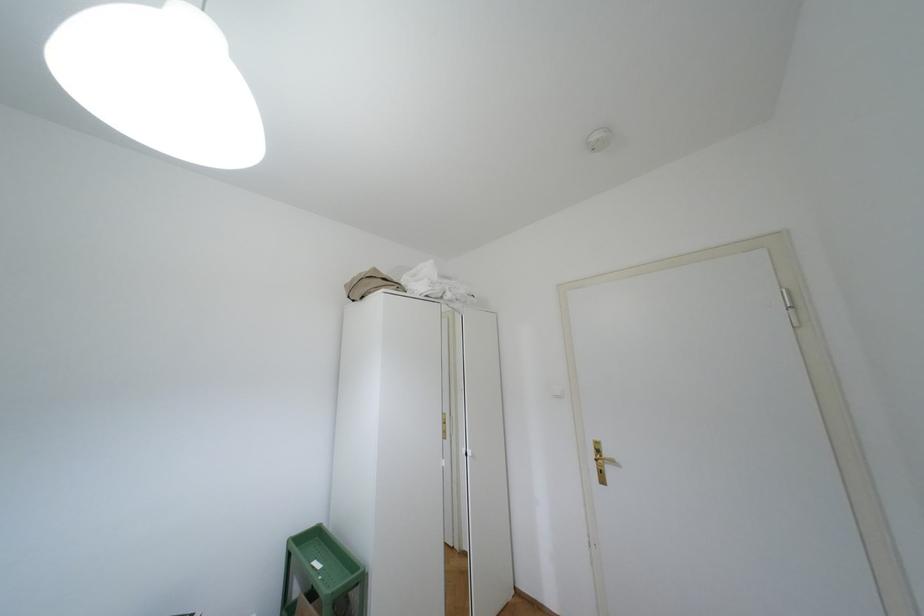
Where would you turn the gold door handle? Please return your answer as a coordinate pair (x, y).

(602, 458)